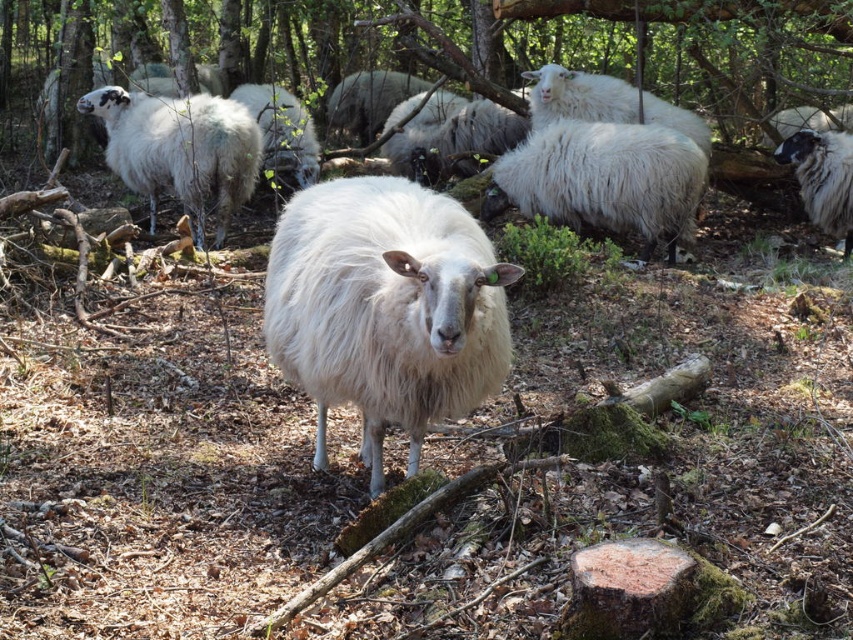
Which is more to the right, green mossy log at upper center or white fluffy sheep at upper left?

Positioned to the right is green mossy log at upper center.

Based on the photo, which of these two, green mossy log at upper center or white fluffy sheep at upper left, stands shorter?

white fluffy sheep at upper left

Locate an element on the screen. Image resolution: width=853 pixels, height=640 pixels. green mossy log at upper center is located at coordinates (552, 44).

Between green mossy log at upper center and white woolen sheep at right, which one is positioned lower?

white woolen sheep at right is lower down.

Is green mossy log at upper center in front of white woolen sheep at right?

No.

Does point (541, 8) come farther from viewer compared to point (820, 177)?

Yes, it is.

At what (x,y) coordinates should I click in order to perform the action: click on green mossy log at upper center. Please return your answer as a coordinate pair (x, y). Looking at the image, I should click on (552, 44).

Does green mossy log at upper center come in front of white fluffy sheep at center?

No, green mossy log at upper center is behind white fluffy sheep at center.

Which is behind, point (357, 10) or point (422, 296)?

The point (357, 10) is behind.

The height and width of the screenshot is (640, 853). In order to click on green mossy log at upper center in this screenshot , I will do `click(552, 44)`.